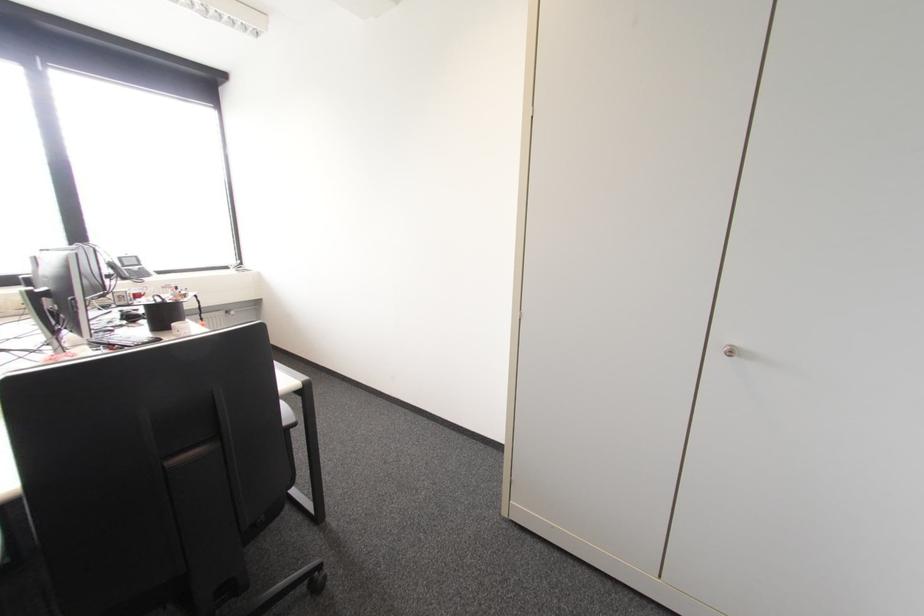
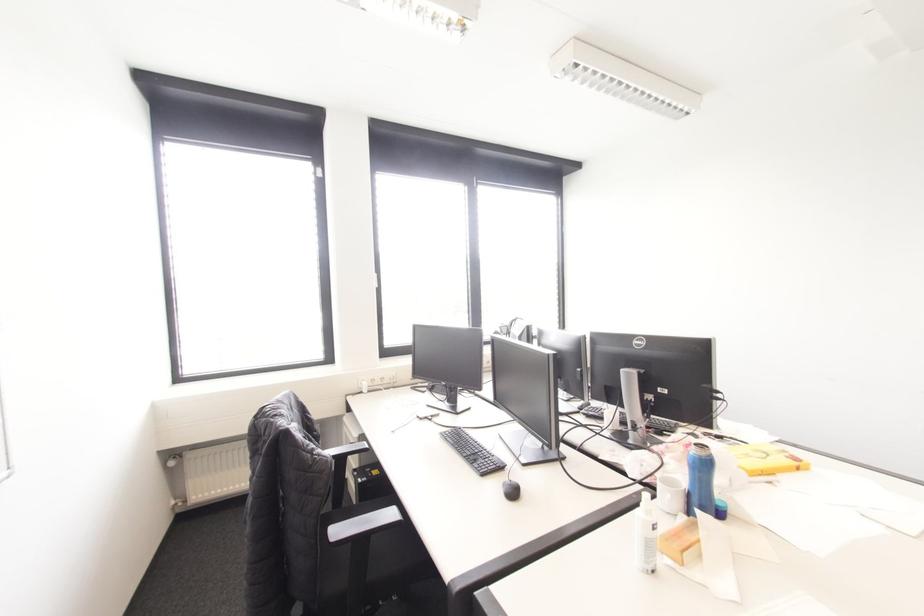
Question: Which direction would the cameraman need to move to produce the second image? Reply with the corresponding letter.

Choices:
 (A) Left
 (B) Right
 (C) Forward
 (D) Backward

Answer: (A)